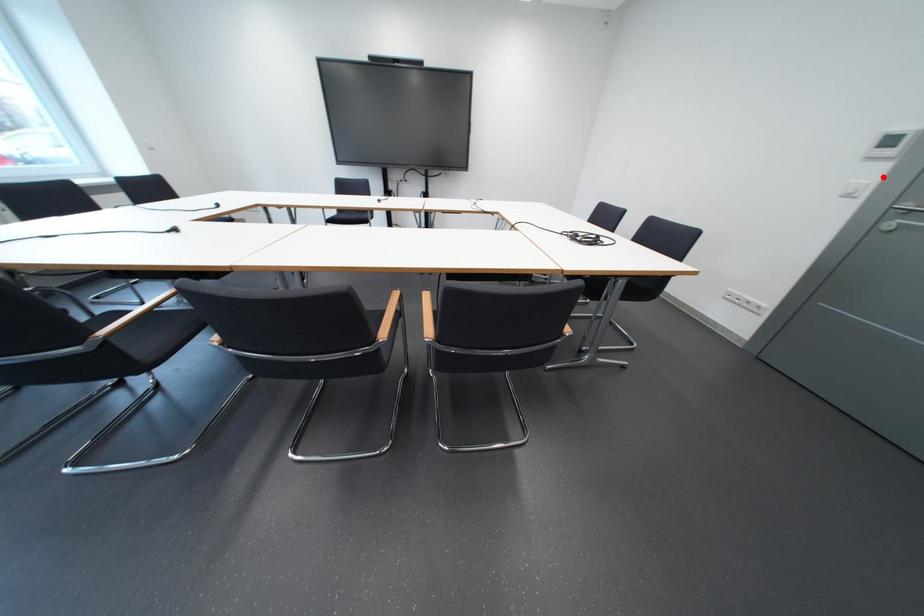
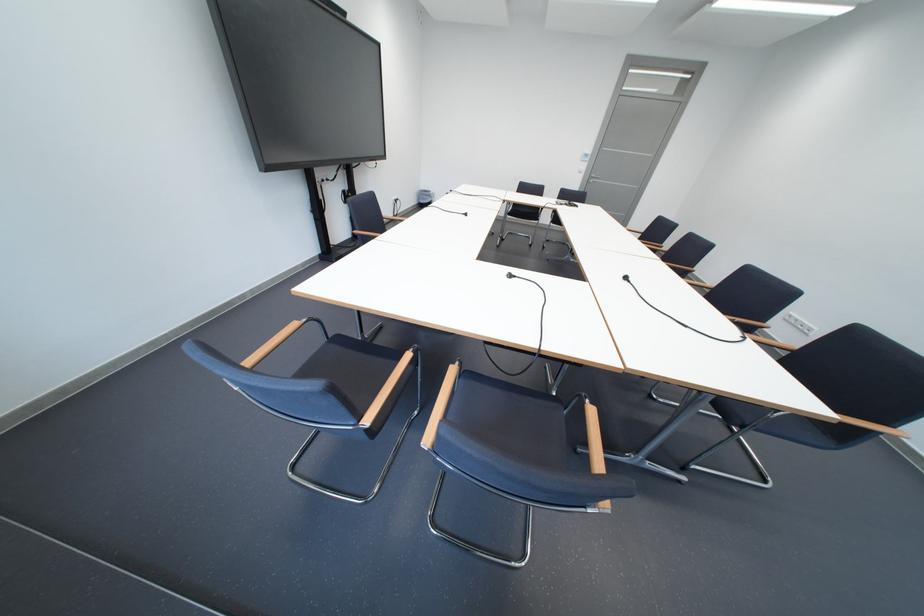
The point at the highlighted location is marked in the first image. Where is the corresponding point in the second image?

(596, 168)